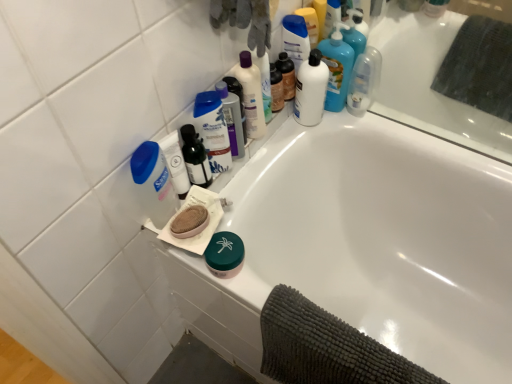
Question: From a real-world perspective, is white glossy bathtub at upper center located beneath matte black bottle at upper center, which is the first toiletry from right to left?

Choices:
 (A) yes
 (B) no

Answer: (A)

Question: Would you consider white glossy bathtub at upper center to be distant from matte black bottle at upper center, which is the first toiletry from right to left?

Choices:
 (A) yes
 (B) no

Answer: (B)

Question: Is the position of white glossy bathtub at upper center more distant than that of matte black bottle at upper center, the 1th toiletry viewed from the back?

Choices:
 (A) yes
 (B) no

Answer: (B)

Question: Is matte black bottle at upper center, the second toiletry positioned from the bottom, located within white glossy bathtub at upper center?

Choices:
 (A) yes
 (B) no

Answer: (B)

Question: Is white glossy bathtub at upper center oriented towards matte black bottle at upper center, the 1th toiletry viewed from the back?

Choices:
 (A) yes
 (B) no

Answer: (B)

Question: In terms of width, does translucent plastic bottle at upper center, positioned as the 3th cleaning product in left-to-right order, look wider or thinner when compared to blue plastic mouthwash at upper center, placed as the 3th mouthwash when sorted from right to left?

Choices:
 (A) wide
 (B) thin

Answer: (A)

Question: From the image's perspective, is translucent plastic bottle at upper center, positioned as the 3th cleaning product in left-to-right order, located above or below blue plastic mouthwash at upper center, placed as the 3th mouthwash when sorted from right to left?

Choices:
 (A) above
 (B) below

Answer: (A)

Question: Choose the correct answer: Is translucent plastic bottle at upper center, the 4th cleaning product when ordered from right to left, inside blue plastic mouthwash at upper center, placed as the 3th mouthwash when sorted from right to left, or outside it?

Choices:
 (A) inside
 (B) outside

Answer: (B)

Question: Is translucent plastic bottle at upper center, positioned as the 3th cleaning product in left-to-right order, in front of or behind blue plastic mouthwash at upper center, acting as the second mouthwash starting from the left, in the image?

Choices:
 (A) behind
 (B) front

Answer: (A)

Question: From the image's perspective, is translucent plastic bottle at upper center, positioned as the 3th cleaning product in left-to-right order, located above or below translucent plastic bottle at upper center, the second toiletry from the right?

Choices:
 (A) below
 (B) above

Answer: (B)

Question: Is translucent plastic bottle at upper center, the 4th cleaning product when ordered from right to left, spatially inside translucent plastic bottle at upper center, positioned as the first toiletry in left-to-right order, or outside of it?

Choices:
 (A) inside
 (B) outside

Answer: (B)

Question: Is translucent plastic bottle at upper center, positioned as the 3th cleaning product in left-to-right order, bigger or smaller than translucent plastic bottle at upper center, the 1th toiletry in the front-to-back sequence?

Choices:
 (A) small
 (B) big

Answer: (B)

Question: Considering their positions, is translucent plastic bottle at upper center, the 4th cleaning product when ordered from right to left, located in front of or behind translucent plastic bottle at upper center, positioned as the first toiletry in left-to-right order?

Choices:
 (A) front
 (B) behind

Answer: (B)

Question: Is point (285, 72) closer or farther from the camera than point (185, 167)?

Choices:
 (A) farther
 (B) closer

Answer: (A)

Question: Is matte black bottle at upper center, the second toiletry positioned from the bottom, taller or shorter than translucent plastic bottle at upper center, the second toiletry from the right?

Choices:
 (A) short
 (B) tall

Answer: (A)